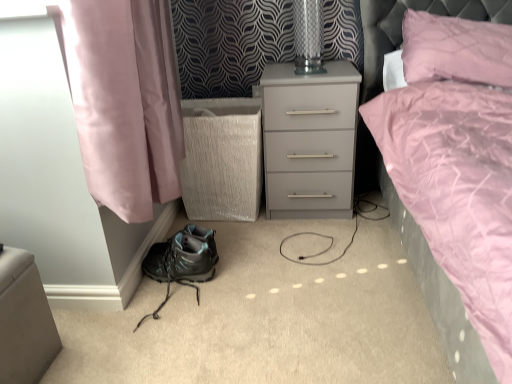
Question: Does matte gray nightstand at center come in front of matte black hiking boot at lower left?

Choices:
 (A) no
 (B) yes

Answer: (A)

Question: Considering the relative positions of matte gray nightstand at center and matte black hiking boot at lower left in the image provided, is matte gray nightstand at center to the left of matte black hiking boot at lower left from the viewer's perspective?

Choices:
 (A) no
 (B) yes

Answer: (A)

Question: Is matte gray nightstand at center oriented towards matte black hiking boot at lower left?

Choices:
 (A) yes
 (B) no

Answer: (B)

Question: Is matte gray nightstand at center far away from matte black hiking boot at lower left?

Choices:
 (A) yes
 (B) no

Answer: (B)

Question: Is matte gray nightstand at center wider than matte black hiking boot at lower left?

Choices:
 (A) no
 (B) yes

Answer: (B)

Question: Does matte gray nightstand at center contain matte black hiking boot at lower left?

Choices:
 (A) yes
 (B) no

Answer: (B)

Question: Considering the relative sizes of transparent glass table lamp at upper center and pink quilted pillow at upper right in the image provided, is transparent glass table lamp at upper center smaller than pink quilted pillow at upper right?

Choices:
 (A) yes
 (B) no

Answer: (A)

Question: Is transparent glass table lamp at upper center positioned with its back to pink quilted pillow at upper right?

Choices:
 (A) no
 (B) yes

Answer: (A)

Question: From a real-world perspective, is transparent glass table lamp at upper center positioned under pink quilted pillow at upper right based on gravity?

Choices:
 (A) no
 (B) yes

Answer: (A)

Question: Considering the relative positions of transparent glass table lamp at upper center and pink quilted pillow at upper right in the image provided, is transparent glass table lamp at upper center to the left of pink quilted pillow at upper right from the viewer's perspective?

Choices:
 (A) yes
 (B) no

Answer: (A)

Question: Considering the relative sizes of transparent glass table lamp at upper center and pink quilted pillow at upper right in the image provided, is transparent glass table lamp at upper center shorter than pink quilted pillow at upper right?

Choices:
 (A) no
 (B) yes

Answer: (B)

Question: Does transparent glass table lamp at upper center have a greater height compared to pink quilted pillow at upper right?

Choices:
 (A) no
 (B) yes

Answer: (A)

Question: Is matte gray nightstand at center wider than matte black hiking boot at lower left?

Choices:
 (A) no
 (B) yes

Answer: (B)